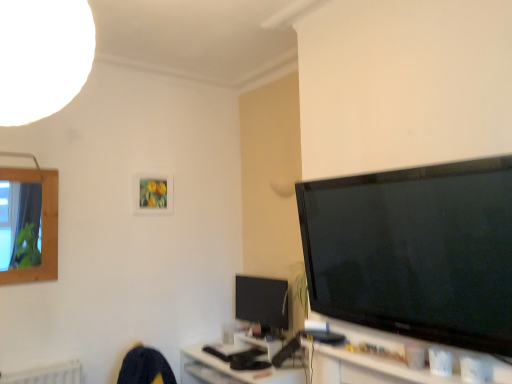
Question: From the image's perspective, is black matte keyboard at lower center above white glossy tv cabinet at lower right?

Choices:
 (A) no
 (B) yes

Answer: (A)

Question: Is the position of black matte keyboard at lower center more distant than that of white glossy tv cabinet at lower right?

Choices:
 (A) no
 (B) yes

Answer: (B)

Question: Is black matte keyboard at lower center shorter than white glossy tv cabinet at lower right?

Choices:
 (A) yes
 (B) no

Answer: (B)

Question: Is black matte keyboard at lower center positioned far away from white glossy tv cabinet at lower right?

Choices:
 (A) yes
 (B) no

Answer: (B)

Question: Can you confirm if black matte keyboard at lower center is bigger than white glossy tv cabinet at lower right?

Choices:
 (A) no
 (B) yes

Answer: (B)

Question: From the image's perspective, is matte wooden picture frame at upper center located above or below black matte keyboard at lower center?

Choices:
 (A) above
 (B) below

Answer: (A)

Question: In the image, is matte wooden picture frame at upper center positioned in front of or behind black matte keyboard at lower center?

Choices:
 (A) behind
 (B) front

Answer: (A)

Question: Do you think matte wooden picture frame at upper center is within black matte keyboard at lower center, or outside of it?

Choices:
 (A) inside
 (B) outside

Answer: (B)

Question: Is point (143, 195) positioned closer to the camera than point (190, 362)?

Choices:
 (A) closer
 (B) farther

Answer: (B)

Question: From a real-world perspective, relative to matte black monitor at center, is white glossy tv cabinet at lower right vertically above or below?

Choices:
 (A) above
 (B) below

Answer: (B)

Question: Is white glossy tv cabinet at lower right spatially inside matte black monitor at center, or outside of it?

Choices:
 (A) outside
 (B) inside

Answer: (A)

Question: Considering their positions, is white glossy tv cabinet at lower right located in front of or behind matte black monitor at center?

Choices:
 (A) behind
 (B) front

Answer: (B)

Question: From the image's perspective, is white glossy tv cabinet at lower right positioned above or below matte black monitor at center?

Choices:
 (A) above
 (B) below

Answer: (A)

Question: From the image's perspective, is wooden frame at left positioned above or below matte wooden picture frame at upper center?

Choices:
 (A) above
 (B) below

Answer: (B)

Question: From a real-world perspective, is wooden frame at left positioned above or below matte wooden picture frame at upper center?

Choices:
 (A) below
 (B) above

Answer: (A)